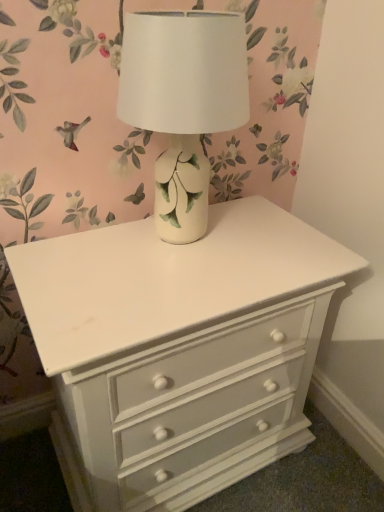
Where is `vacant space in front of white ceramic table lamp at center`? vacant space in front of white ceramic table lamp at center is located at coordinates (162, 290).